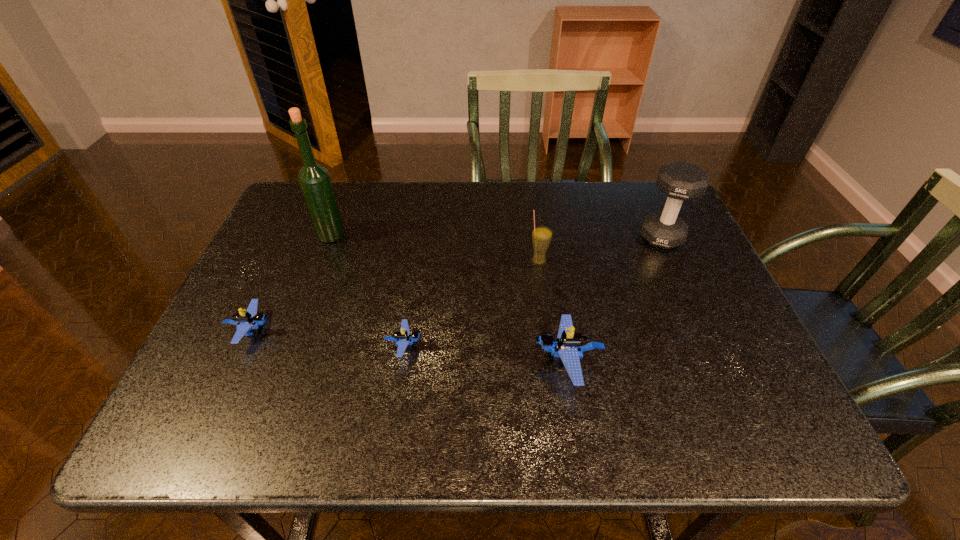
Please show where to add a Lego on the right while keeping spacing even. Please provide its 2D coordinates. Your answer should be formatted as a tuple, i.e. [(x, y)], where the tuple contains the x and y coordinates of a point satisfying the conditions above.

[(740, 379)]